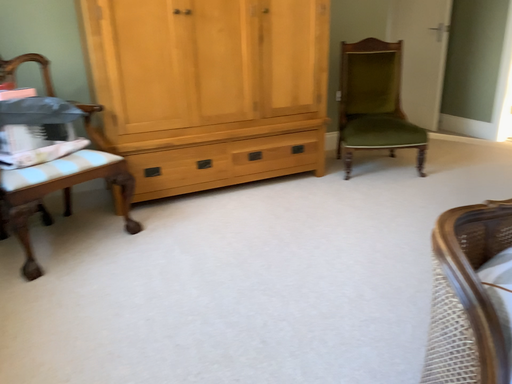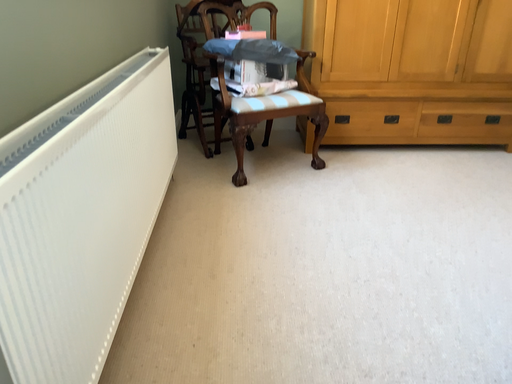
Question: How did the camera likely rotate when shooting the video?

Choices:
 (A) rotated right
 (B) rotated left

Answer: (B)